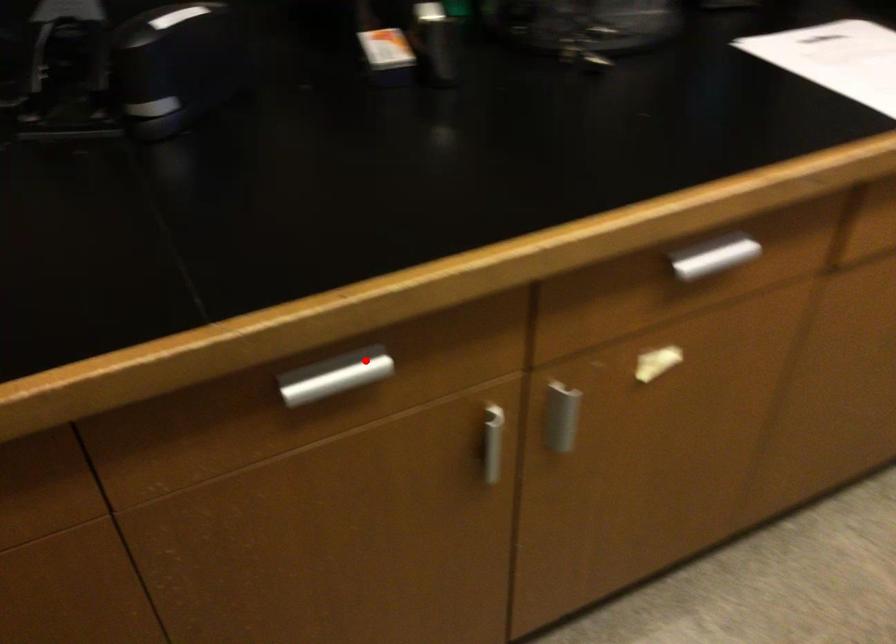
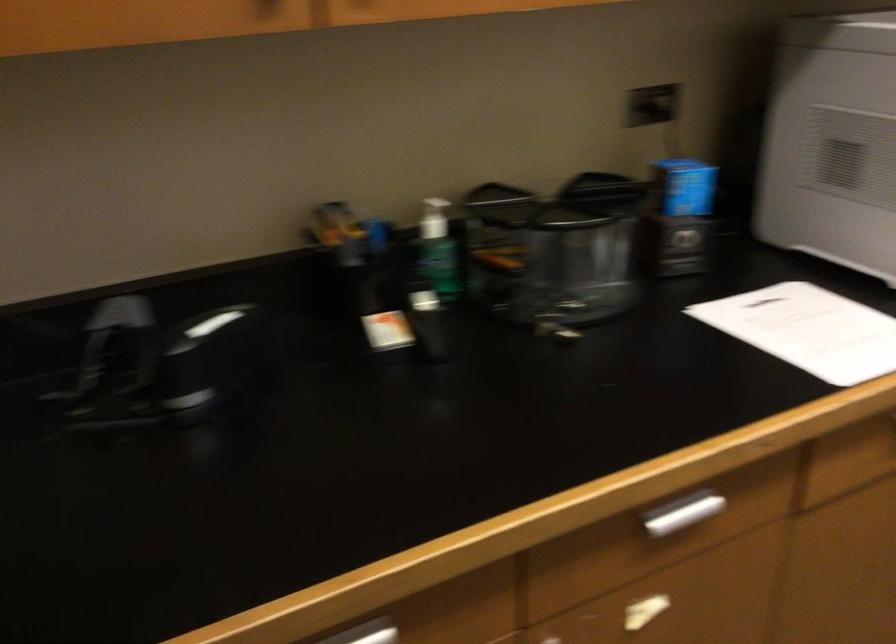
Locate, in the second image, the point that corresponds to the highlighted location in the first image.

(369, 630)